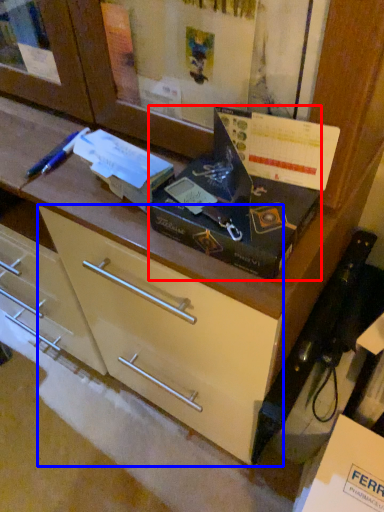
Question: Which object is closer to the camera taking this photo, box (highlighted by a red box) or drawer (highlighted by a blue box)?

Choices:
 (A) box
 (B) drawer

Answer: (A)